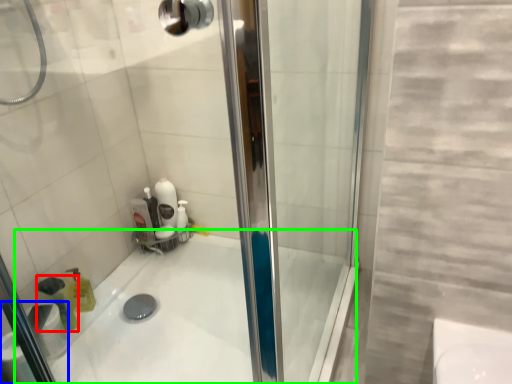
Question: Which object is positioned closest to cleaning product (highlighted by a red box)? Select from toilet paper (highlighted by a blue box) and bath (highlighted by a green box).

Choices:
 (A) toilet paper
 (B) bath

Answer: (A)